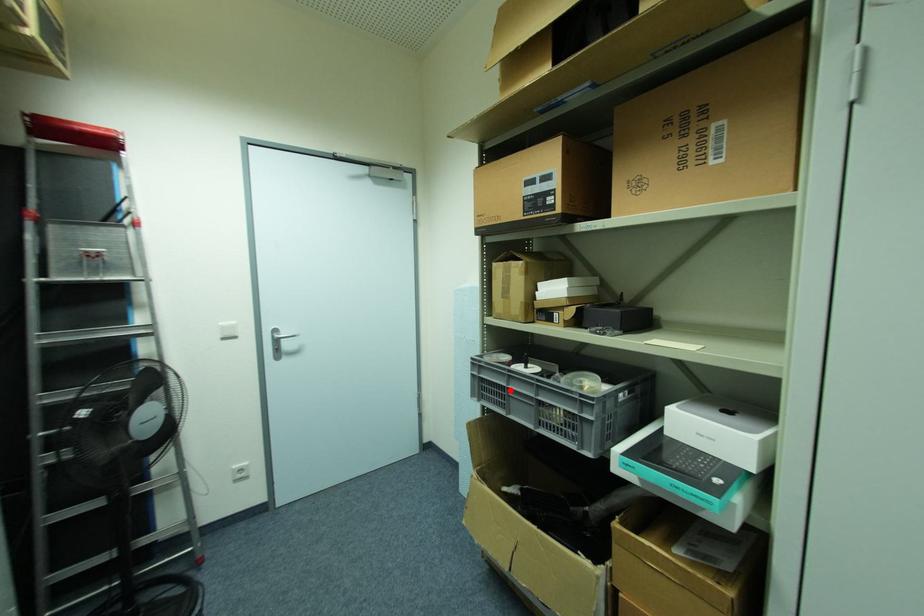
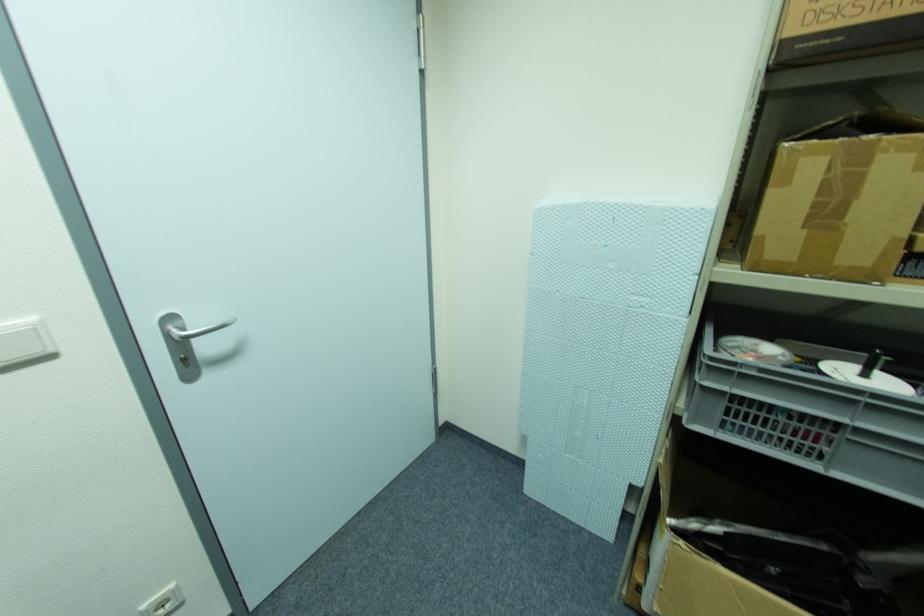
Where in the second image is the point corresponding to the highlighted location from the first image?

(859, 432)